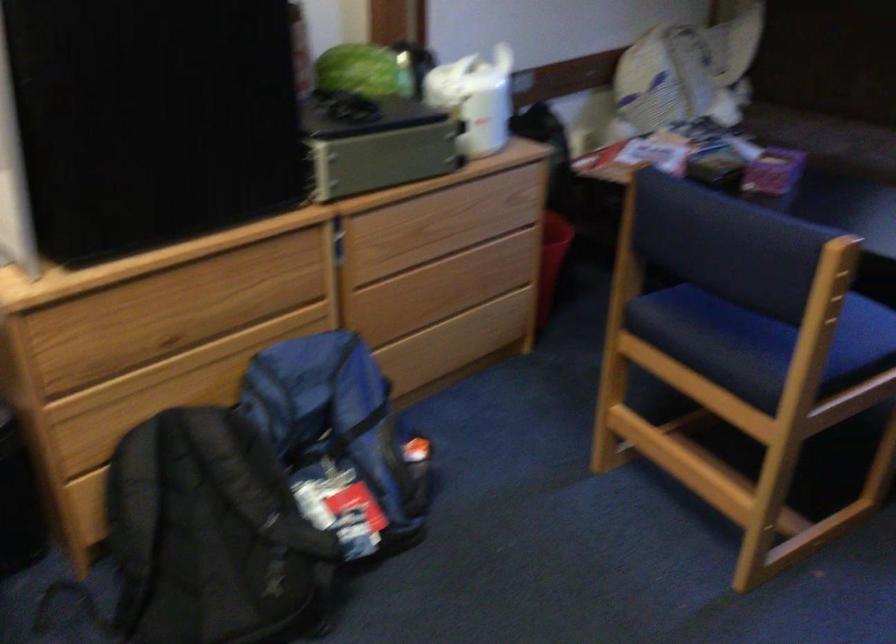
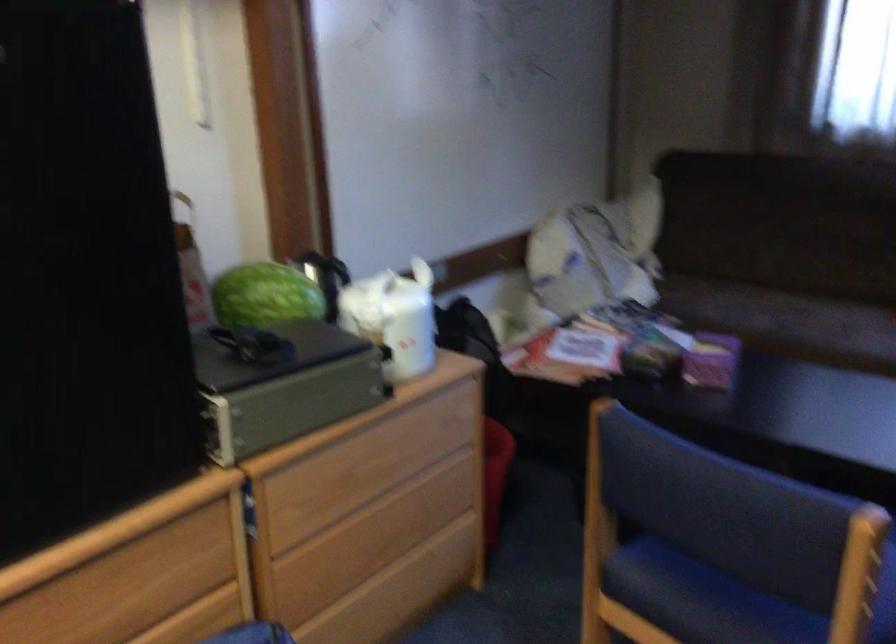
Where in the second image is the point corresponding to pixel 554 254 from the first image?

(495, 474)